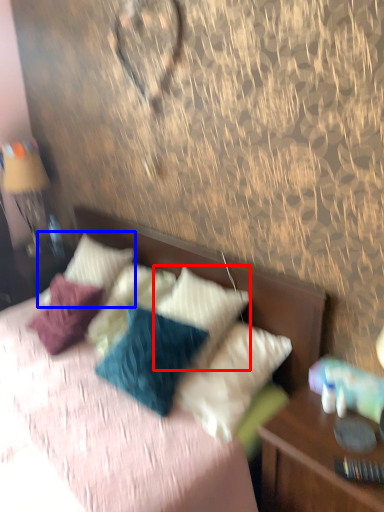
Question: Which object is closer to the camera taking this photo, pillow (highlighted by a red box) or pillow (highlighted by a blue box)?

Choices:
 (A) pillow
 (B) pillow

Answer: (A)